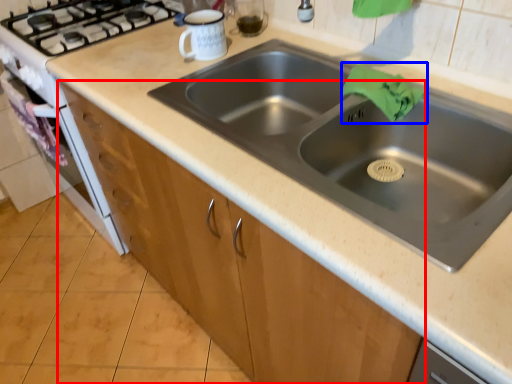
Question: Among these objects, which one is nearest to the camera, cabinetry (highlighted by a red box) or cloth (highlighted by a blue box)?

Choices:
 (A) cabinetry
 (B) cloth

Answer: (B)